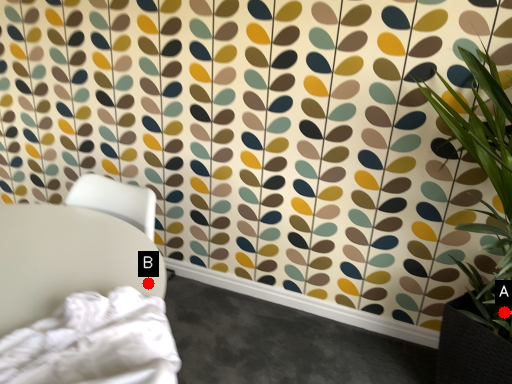
Question: Two points are circled on the image, labeled by A and B beside each circle. Which point is closer to the camera?

Choices:
 (A) A is closer
 (B) B is closer

Answer: (B)